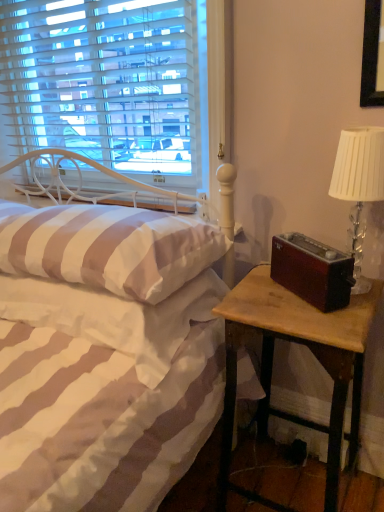
What do you see at coordinates (105, 355) in the screenshot? I see `white striped bed at center` at bounding box center [105, 355].

What do you see at coordinates (359, 185) in the screenshot? I see `clear glass table lamp at right` at bounding box center [359, 185].

You are a GUI agent. You are given a task and a screenshot of the screen. Output one action in this format:
    pyautogui.click(x=<x>, y=<y>)
    Task: Click on the white striped fabric at lower left
    
    Given the screenshot: What is the action you would take?
    pyautogui.click(x=115, y=316)

Can you tell me how much wooden nightstand at right and white striped pillow at center differ in facing direction?

wooden nightstand at right and white striped pillow at center are facing 1.59 degrees away from each other.

Is wooden nightstand at right in front of or behind white striped pillow at center in the image?

Visually, wooden nightstand at right is located behind white striped pillow at center.

Is wooden nightstand at right facing towards white striped pillow at center?

No.

Would you say wooden nightstand at right is outside white striped pillow at center?

That's correct, wooden nightstand at right is outside of white striped pillow at center.

Which object is positioned more to the right, wooden nightstand at right or clear glass table lamp at right?

clear glass table lamp at right.

Would you say wooden nightstand at right is inside or outside clear glass table lamp at right?

wooden nightstand at right is located beyond the bounds of clear glass table lamp at right.

Considering the sizes of wooden nightstand at right and clear glass table lamp at right in the image, is wooden nightstand at right wider or thinner than clear glass table lamp at right?

Clearly, wooden nightstand at right has more width compared to clear glass table lamp at right.

Which is behind, point (357, 314) or point (379, 133)?

Positioned behind is point (357, 314).

Looking at their sizes, would you say white striped pillow at center is wider or thinner than clear glass table lamp at right?

Considering their sizes, white striped pillow at center looks broader than clear glass table lamp at right.

From the image's perspective, between white striped pillow at center and clear glass table lamp at right, which one is located above?

clear glass table lamp at right.

Are white striped pillow at center and clear glass table lamp at right located far from each other?

No, white striped pillow at center is not far from clear glass table lamp at right.

Is clear glass table lamp at right at the back of white striped pillow at center?

No.

The width and height of the screenshot is (384, 512). Identify the location of nightstand behind the white striped bed at center. (310, 350).

From the image's perspective, which object appears higher, white striped bed at center or wooden nightstand at right?

white striped bed at center appears higher in the image.

Which of these two, white striped bed at center or wooden nightstand at right, is thinner?

Thinner between the two is wooden nightstand at right.

Considering the positions of objects white striped bed at center and wooden nightstand at right in the image provided, who is in front, white striped bed at center or wooden nightstand at right?

white striped bed at center is closer to the camera.

In the scene shown: Relative to wooden nightstand at right, is white striped fabric at lower left in front or behind?

white striped fabric at lower left is positioned closer to the viewer than wooden nightstand at right.

Could you tell me if white striped fabric at lower left is turned towards wooden nightstand at right?

No.

In terms of size, does white striped fabric at lower left appear bigger or smaller than wooden nightstand at right?

In the image, white striped fabric at lower left appears to be smaller than wooden nightstand at right.

Considering the positions of objects white striped fabric at lower left and wooden nightstand at right in the image provided, who is more to the left, white striped fabric at lower left or wooden nightstand at right?

From the viewer's perspective, white striped fabric at lower left appears more on the left side.

Does clear glass table lamp at right touch white striped pillow at center?

No, clear glass table lamp at right is not making contact with white striped pillow at center.

From the picture: What's the angular difference between clear glass table lamp at right and white striped pillow at center's facing directions?

The facing directions of clear glass table lamp at right and white striped pillow at center are 4.23 degrees apart.

Which is more distant, (x=353, y=170) or (x=170, y=240)?

Point (x=170, y=240)

In the image, there is a clear glass table lamp at right. Where is `pillow below it (from a real-world perspective)`? Image resolution: width=384 pixels, height=512 pixels. pillow below it (from a real-world perspective) is located at coordinates (108, 247).

Could you tell me if white striped fabric at lower left is turned towards clear glass table lamp at right?

No, white striped fabric at lower left is not turned towards clear glass table lamp at right.

Is white striped fabric at lower left situated inside clear glass table lamp at right or outside?

white striped fabric at lower left is not enclosed by clear glass table lamp at right.

I want to click on nightstand behind the white striped pillow at center, so click(310, 350).

This screenshot has width=384, height=512. Find the location of `nightstand located underneath the clear glass table lamp at right (from a real-world perspective)`. nightstand located underneath the clear glass table lamp at right (from a real-world perspective) is located at coordinates (310, 350).

Looking at the image, which one is located further to wooden nightstand at right, white striped fabric at lower left or clear glass table lamp at right?

white striped fabric at lower left.

Which object lies nearer to the anchor point white striped pillow at center, white striped fabric at lower left or clear glass table lamp at right?

The object closer to white striped pillow at center is white striped fabric at lower left.

When comparing their distances from white striped fabric at lower left, does wooden nightstand at right or clear glass table lamp at right seem further?

clear glass table lamp at right is further to white striped fabric at lower left.

Based on their spatial positions, is white striped bed at center or clear glass table lamp at right closer to white striped pillow at center?

Based on the image, white striped bed at center appears to be nearer to white striped pillow at center.

From the image, which object appears to be farther from white striped pillow at center, clear glass table lamp at right or white striped fabric at lower left?

clear glass table lamp at right.

From the image, which object appears to be farther from wooden nightstand at right, white striped pillow at center or clear glass table lamp at right?

Based on the image, white striped pillow at center appears to be further to wooden nightstand at right.

Considering their positions, is wooden nightstand at right positioned closer to white striped fabric at lower left than white striped pillow at center?

white striped pillow at center lies closer to white striped fabric at lower left than the other object.

From the image, which object appears to be farther from white striped pillow at center, wooden nightstand at right or clear glass table lamp at right?

clear glass table lamp at right is positioned further to the anchor white striped pillow at center.

Identify the location of mattress between white striped pillow at center and clear glass table lamp at right. (115, 316).

Where is `pillow between white striped bed at center and clear glass table lamp at right`? The image size is (384, 512). pillow between white striped bed at center and clear glass table lamp at right is located at coordinates (108, 247).

Find the location of a particular element. mattress between white striped pillow at center and wooden nightstand at right from left to right is located at coordinates (115, 316).

Identify the location of nightstand situated between white striped fabric at lower left and clear glass table lamp at right from left to right. (310, 350).